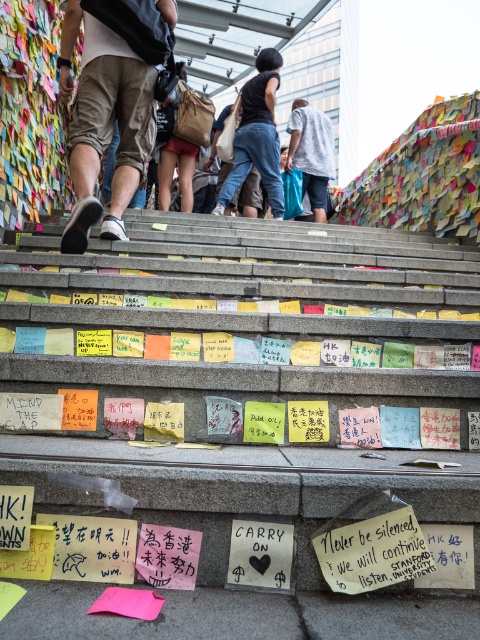
You are standing at the bottom of the staircase covered with colorful sticky notes. You notice a khaki cotton shorts at lower left and a black matte tank top at center. Which item is shorter in height?

The khaki cotton shorts at lower left is not as tall as the black matte tank top at center, so the khaki cotton shorts at lower left is shorter in height.

You are a delivery person trying to place a khaki cotton shorts at lower left and a brown canvas bag at center on a table. If the table can only hold items that are narrower than 30 cm, which item might not fit?

The khaki cotton shorts at lower left might not fit on the table because it might be wider than the brown canvas bag at center, and if the khaki cotton shorts at lower left exceeds 30 cm in width, it would not fit.

You are standing at the base of the staircase covered in colorful sticky notes. You notice a khaki cotton shorts at lower left. Can you determine its exact location on the staircase using coordinates?

The khaki cotton shorts at lower left is located at point coordinates of [104,122].